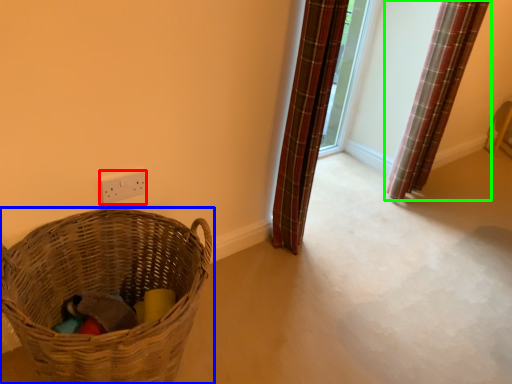
Question: Which object is positioned farthest from electric outlet (highlighted by a red box)? Select from picnic basket (highlighted by a blue box) and curtain (highlighted by a green box).

Choices:
 (A) picnic basket
 (B) curtain

Answer: (B)